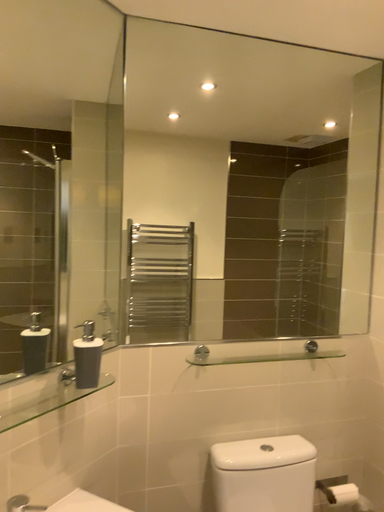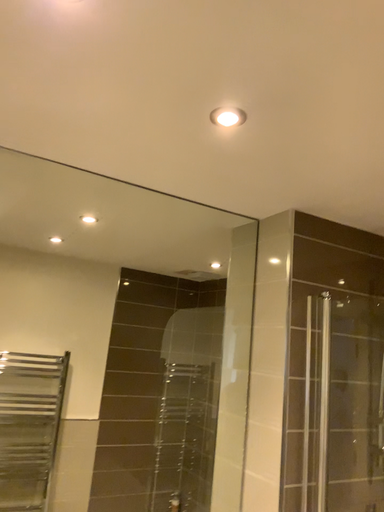
Question: Which way did the camera rotate in the video?

Choices:
 (A) rotated downward
 (B) rotated upward

Answer: (B)